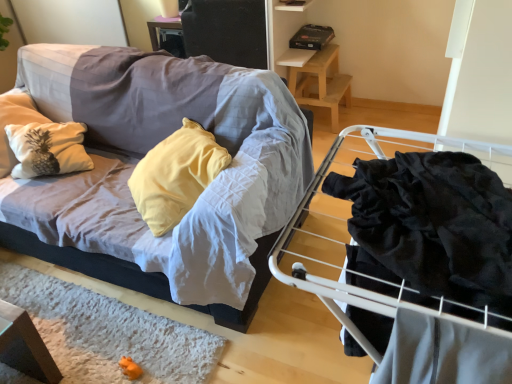
Question: Is textured fabric couch at left oriented towards wooden stool at upper right?

Choices:
 (A) no
 (B) yes

Answer: (A)

Question: Does textured fabric couch at left have a lesser height compared to wooden stool at upper right?

Choices:
 (A) yes
 (B) no

Answer: (B)

Question: From a real-world perspective, is textured fabric couch at left located beneath wooden stool at upper right?

Choices:
 (A) yes
 (B) no

Answer: (B)

Question: Is textured fabric couch at left turned away from wooden stool at upper right?

Choices:
 (A) no
 (B) yes

Answer: (B)

Question: Can you confirm if textured fabric couch at left is bigger than wooden stool at upper right?

Choices:
 (A) no
 (B) yes

Answer: (B)

Question: Is wooden stool at upper right wider or thinner than textured fabric couch at left?

Choices:
 (A) wide
 (B) thin

Answer: (B)

Question: From a real-world perspective, is wooden stool at upper right physically located above or below textured fabric couch at left?

Choices:
 (A) below
 (B) above

Answer: (A)

Question: Would you say wooden stool at upper right is to the left or to the right of textured fabric couch at left in the picture?

Choices:
 (A) left
 (B) right

Answer: (B)

Question: Based on their sizes in the image, would you say wooden stool at upper right is bigger or smaller than textured fabric couch at left?

Choices:
 (A) small
 (B) big

Answer: (A)

Question: Is black velvet fabric at right wider or thinner than wooden stool at upper right?

Choices:
 (A) thin
 (B) wide

Answer: (B)

Question: In terms of height, does black velvet fabric at right look taller or shorter compared to wooden stool at upper right?

Choices:
 (A) short
 (B) tall

Answer: (A)

Question: From a real-world perspective, relative to wooden stool at upper right, is black velvet fabric at right vertically above or below?

Choices:
 (A) below
 (B) above

Answer: (B)

Question: Considering the relative positions of black velvet fabric at right and wooden stool at upper right in the image provided, is black velvet fabric at right to the left or to the right of wooden stool at upper right?

Choices:
 (A) left
 (B) right

Answer: (A)

Question: Do you think textured fabric couch at left is within black velvet fabric at right, or outside of it?

Choices:
 (A) outside
 (B) inside

Answer: (A)

Question: Considering the positions of textured fabric couch at left and black velvet fabric at right in the image, is textured fabric couch at left bigger or smaller than black velvet fabric at right?

Choices:
 (A) big
 (B) small

Answer: (A)